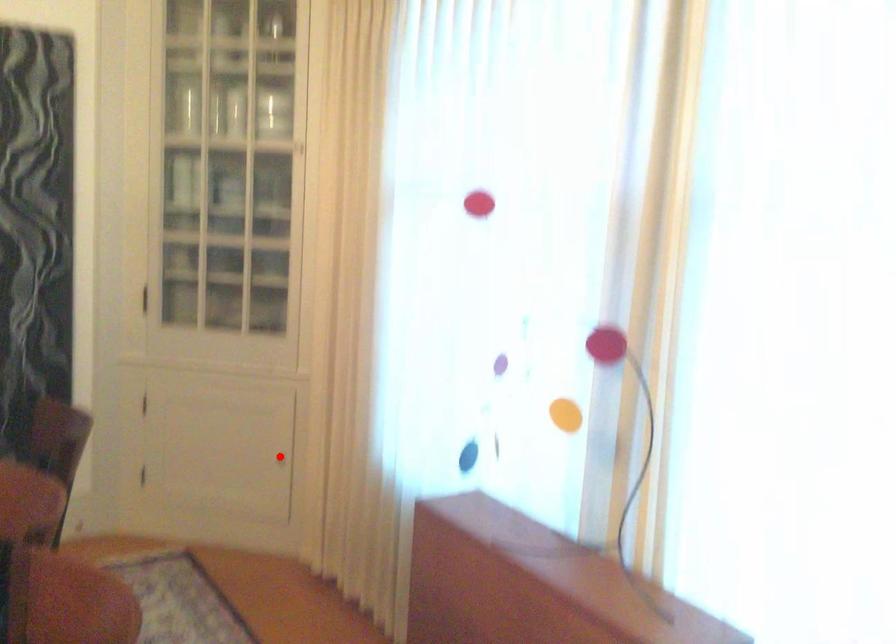
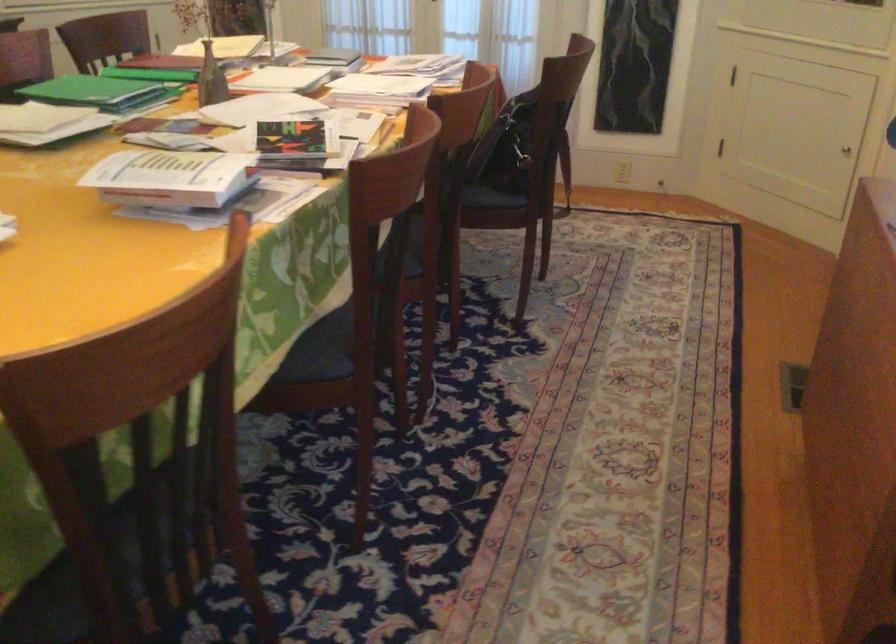
Question: I am providing you with two images of the same scene from different viewpoints. Image1 has a red point marked. In image2, the corresponding 3D location appears at what relative position? Reply with the corresponding letter.

Choices:
 (A) Closer
 (B) Farther

Answer: (A)